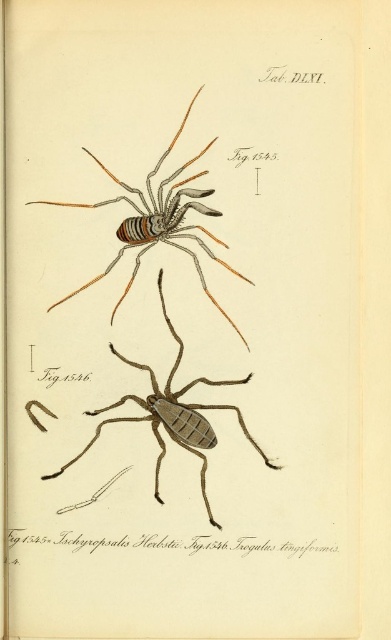
In the scene shown: Is matte striped spider at upper center positioned at the back of brown matte spider at center?

No, matte striped spider at upper center is closer to the viewer.

Does point (147, 212) come closer to viewer compared to point (170, 376)?

Yes.

Locate an element on the screen. matte striped spider at upper center is located at coordinates (159, 221).